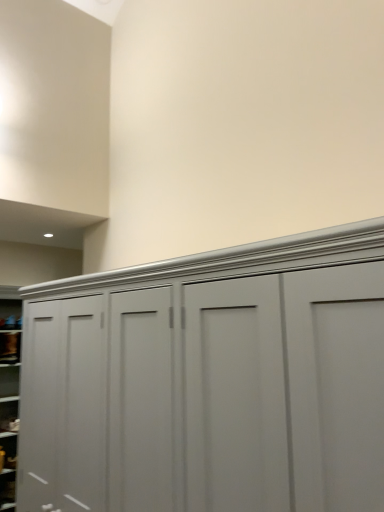
The height and width of the screenshot is (512, 384). What do you see at coordinates (7, 488) in the screenshot? I see `matte gray cabinet at lower left, which ranks as the 1th cabinet in bottom-to-top order` at bounding box center [7, 488].

Describe the element at coordinates (10, 347) in the screenshot. I see `matte gray cabinet at lower left, placed as the 2th cabinet when sorted from bottom to top` at that location.

In order to face matte gray cupboard at center, should I rotate leftwards or rightwards?

Turn left by 1.999 degrees to look at matte gray cupboard at center.

At what (x,y) coordinates should I click in order to perform the action: click on matte gray cabinet at lower left, which ranks as the 1th cabinet in bottom-to-top order. Please return your answer as a coordinate pair (x, y). The image size is (384, 512). Looking at the image, I should click on (7, 488).

The width and height of the screenshot is (384, 512). I want to click on cupboard above the matte gray cabinet at lower left, which ranks as the 1th cabinet in bottom-to-top order (from the image's perspective), so tap(185, 376).

Measure the distance from matte gray cabinet at lower left, which ranks as the 1th cabinet in bottom-to-top order, to matte gray cupboard at center.

2.69 meters.

Which is behind, matte gray cabinet at lower left, which ranks as the 1th cabinet in bottom-to-top order, or matte gray cupboard at center?

matte gray cabinet at lower left, which ranks as the 1th cabinet in bottom-to-top order, is further away from the camera.

Considering the relative positions of matte gray cabinet at lower left, the second cabinet when ordered from top to bottom, and matte gray cupboard at center in the image provided, is matte gray cabinet at lower left, the second cabinet when ordered from top to bottom, to the right of matte gray cupboard at center from the viewer's perspective?

Incorrect, matte gray cabinet at lower left, the second cabinet when ordered from top to bottom, is not on the right side of matte gray cupboard at center.

Considering their positions, is matte gray cabinet at lower left, placed as the 2th cabinet when sorted from bottom to top, located in front of or behind matte gray cupboard at center?

matte gray cabinet at lower left, placed as the 2th cabinet when sorted from bottom to top, is behind matte gray cupboard at center.

Looking at this image, considering the relative sizes of matte gray cabinet at lower left, the first cabinet when ordered from top to bottom, and matte gray cupboard at center in the image provided, is matte gray cabinet at lower left, the first cabinet when ordered from top to bottom, taller than matte gray cupboard at center?

Incorrect, the height of matte gray cabinet at lower left, the first cabinet when ordered from top to bottom, is not larger of that of matte gray cupboard at center.

Could you tell me if matte gray cabinet at lower left, the first cabinet when ordered from top to bottom, is turned towards matte gray cupboard at center?

Yes, matte gray cabinet at lower left, the first cabinet when ordered from top to bottom, is aimed at matte gray cupboard at center.

Which point is more forward, (4, 335) or (219, 381)?

The point (219, 381) is in front.

Are matte gray cupboard at center and matte gray cabinet at lower left, which ranks as the 1th cabinet in bottom-to-top order, located far from each other?

Yes.

Which is in front, point (30, 505) or point (15, 490)?

The point (30, 505) is closer to the camera.

Considering the relative sizes of matte gray cupboard at center and matte gray cabinet at lower left, which ranks as the 1th cabinet in bottom-to-top order, in the image provided, is matte gray cupboard at center bigger than matte gray cabinet at lower left, which ranks as the 1th cabinet in bottom-to-top order,?

Yes, matte gray cupboard at center is bigger than matte gray cabinet at lower left, which ranks as the 1th cabinet in bottom-to-top order.

Locate an element on the screen. The image size is (384, 512). cabinet to the left of matte gray cabinet at lower left, which ranks as the 1th cabinet in bottom-to-top order is located at coordinates (10, 347).

Considering the relative sizes of matte gray cabinet at lower left, which ranks as the 1th cabinet in bottom-to-top order, and matte gray cabinet at lower left, the first cabinet when ordered from top to bottom, in the image provided, is matte gray cabinet at lower left, which ranks as the 1th cabinet in bottom-to-top order, smaller than matte gray cabinet at lower left, the first cabinet when ordered from top to bottom,?

Indeed, matte gray cabinet at lower left, which ranks as the 1th cabinet in bottom-to-top order, has a smaller size compared to matte gray cabinet at lower left, the first cabinet when ordered from top to bottom.

Is matte gray cabinet at lower left, the first cabinet when ordered from top to bottom, completely or partially inside matte gray cabinet at lower left, the second cabinet when ordered from top to bottom?

Actually, matte gray cabinet at lower left, the first cabinet when ordered from top to bottom, is outside matte gray cabinet at lower left, the second cabinet when ordered from top to bottom.

Is matte gray cabinet at lower left, which ranks as the 1th cabinet in bottom-to-top order, positioned far away from matte gray cabinet at lower left, the first cabinet when ordered from top to bottom?

Yes, matte gray cabinet at lower left, which ranks as the 1th cabinet in bottom-to-top order, is far from matte gray cabinet at lower left, the first cabinet when ordered from top to bottom.

Considering the positions of objects matte gray cabinet at lower left, the first cabinet when ordered from top to bottom, and matte gray cabinet at lower left, the second cabinet when ordered from top to bottom, in the image provided, who is more to the left, matte gray cabinet at lower left, the first cabinet when ordered from top to bottom, or matte gray cabinet at lower left, the second cabinet when ordered from top to bottom,?

matte gray cabinet at lower left, the first cabinet when ordered from top to bottom, is more to the left.

From the image's perspective, is matte gray cabinet at lower left, the first cabinet when ordered from top to bottom, located above or below matte gray cabinet at lower left, which ranks as the 1th cabinet in bottom-to-top order?

matte gray cabinet at lower left, the first cabinet when ordered from top to bottom, is above matte gray cabinet at lower left, which ranks as the 1th cabinet in bottom-to-top order.

Is matte gray cabinet at lower left, placed as the 2th cabinet when sorted from bottom to top, bigger than matte gray cabinet at lower left, the second cabinet when ordered from top to bottom?

Yes.

Looking at their sizes, would you say matte gray cabinet at lower left, the first cabinet when ordered from top to bottom, is wider or thinner than matte gray cabinet at lower left, the second cabinet when ordered from top to bottom?

Considering their sizes, matte gray cabinet at lower left, the first cabinet when ordered from top to bottom, looks slimmer than matte gray cabinet at lower left, the second cabinet when ordered from top to bottom.

Does matte gray cupboard at center have a greater width compared to matte gray cabinet at lower left, the first cabinet when ordered from top to bottom?

Correct, the width of matte gray cupboard at center exceeds that of matte gray cabinet at lower left, the first cabinet when ordered from top to bottom.

From the image's perspective, which one is positioned lower, matte gray cupboard at center or matte gray cabinet at lower left, the first cabinet when ordered from top to bottom?

From the image's view, matte gray cabinet at lower left, the first cabinet when ordered from top to bottom, is below.

Can you tell me how much matte gray cupboard at center and matte gray cabinet at lower left, placed as the 2th cabinet when sorted from bottom to top, differ in facing direction?

The facing directions of matte gray cupboard at center and matte gray cabinet at lower left, placed as the 2th cabinet when sorted from bottom to top, are 98.9 degrees apart.

Choose the correct answer: Is matte gray cupboard at center inside matte gray cabinet at lower left, the first cabinet when ordered from top to bottom, or outside it?

matte gray cupboard at center lies outside matte gray cabinet at lower left, the first cabinet when ordered from top to bottom.

You are a GUI agent. You are given a task and a screenshot of the screen. Output one action in this format:
    pyautogui.click(x=<x>, y=<y>)
    Task: Click on the cupboard located above the matte gray cabinet at lower left, which ranks as the 1th cabinet in bottom-to-top order (from a real-world perspective)
    This screenshot has height=512, width=384.
    Given the screenshot: What is the action you would take?
    pyautogui.click(x=185, y=376)

Find the location of `the 2nd cabinet to the left of the matte gray cupboard at center, starting your count from the anchor`. the 2nd cabinet to the left of the matte gray cupboard at center, starting your count from the anchor is located at coordinates [x=10, y=347].

Estimate the real-world distances between objects in this image. Which object is further from matte gray cupboard at center, matte gray cabinet at lower left, the second cabinet when ordered from top to bottom, or matte gray cabinet at lower left, placed as the 2th cabinet when sorted from bottom to top?

matte gray cabinet at lower left, placed as the 2th cabinet when sorted from bottom to top, is positioned further to the anchor matte gray cupboard at center.

Based on their spatial positions, is matte gray cupboard at center or matte gray cabinet at lower left, the first cabinet when ordered from top to bottom, closer to matte gray cabinet at lower left, the second cabinet when ordered from top to bottom?

matte gray cabinet at lower left, the first cabinet when ordered from top to bottom.

From the image, which object appears to be nearer to matte gray cabinet at lower left, placed as the 2th cabinet when sorted from bottom to top, matte gray cupboard at center or matte gray cabinet at lower left, which ranks as the 1th cabinet in bottom-to-top order?

matte gray cabinet at lower left, which ranks as the 1th cabinet in bottom-to-top order, lies closer to matte gray cabinet at lower left, placed as the 2th cabinet when sorted from bottom to top, than the other object.

Based on their spatial positions, is matte gray cabinet at lower left, the first cabinet when ordered from top to bottom, or matte gray cupboard at center further from matte gray cabinet at lower left, the second cabinet when ordered from top to bottom?

matte gray cupboard at center lies further to matte gray cabinet at lower left, the second cabinet when ordered from top to bottom, than the other object.

Considering their positions, is matte gray cabinet at lower left, the second cabinet when ordered from top to bottom, positioned closer to matte gray cabinet at lower left, placed as the 2th cabinet when sorted from bottom to top, than matte gray cupboard at center?

The object closer to matte gray cabinet at lower left, placed as the 2th cabinet when sorted from bottom to top, is matte gray cabinet at lower left, the second cabinet when ordered from top to bottom.

Considering their positions, is matte gray cabinet at lower left, the first cabinet when ordered from top to bottom, positioned further to matte gray cupboard at center than matte gray cabinet at lower left, which ranks as the 1th cabinet in bottom-to-top order?

Among the two, matte gray cabinet at lower left, the first cabinet when ordered from top to bottom, is located further to matte gray cupboard at center.

Locate an element on the screen. The width and height of the screenshot is (384, 512). cabinet between matte gray cupboard at center and matte gray cabinet at lower left, the first cabinet when ordered from top to bottom, from front to back is located at coordinates (7, 488).